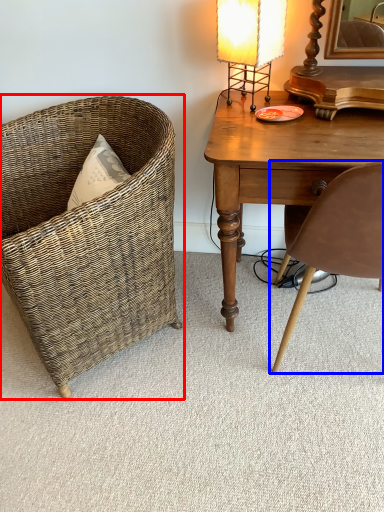
Question: Which object appears closest to the camera in this image, chair (highlighted by a red box) or chair (highlighted by a blue box)?

Choices:
 (A) chair
 (B) chair

Answer: (B)